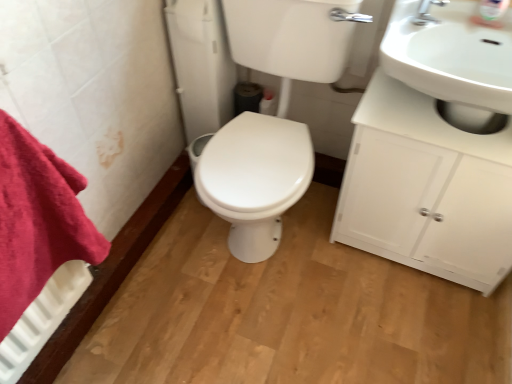
You are a GUI agent. You are given a task and a screenshot of the screen. Output one action in this format:
    pyautogui.click(x=<x>, y=<y>)
    Task: Click on the free spot to the right of silver metallic faucet at upper right
    Image resolution: width=512 pixels, height=384 pixels.
    Given the screenshot: What is the action you would take?
    pyautogui.click(x=456, y=17)